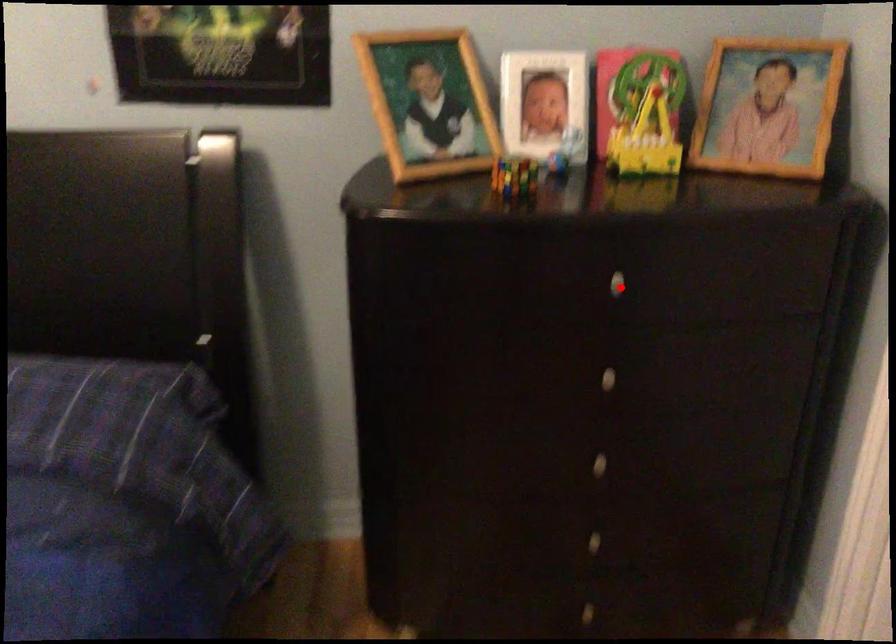
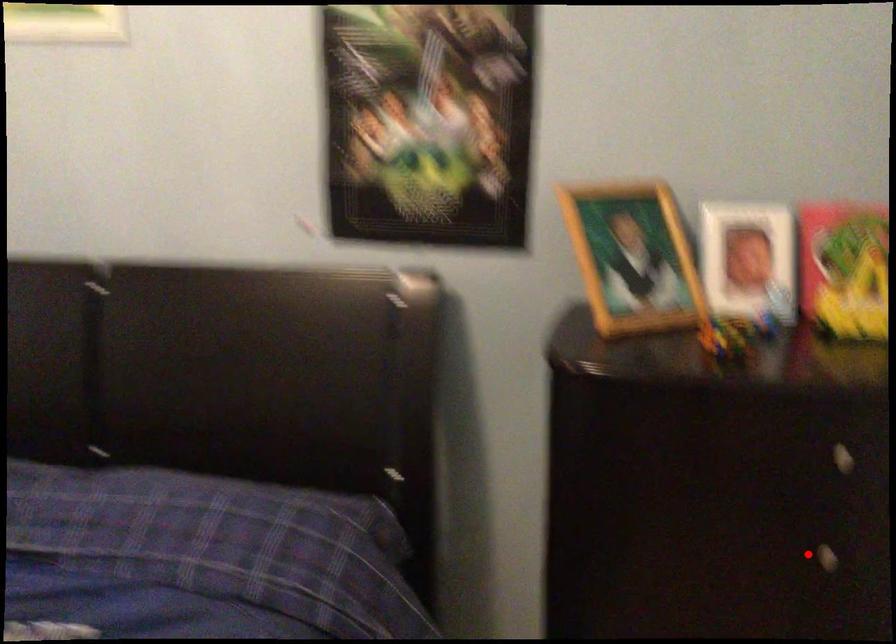
I am providing you with two images of the same scene from different viewpoints. A red point is marked on the first image and another point is marked on the second image. Is the marked point in image1 the same physical position as the marked point in image2?

No